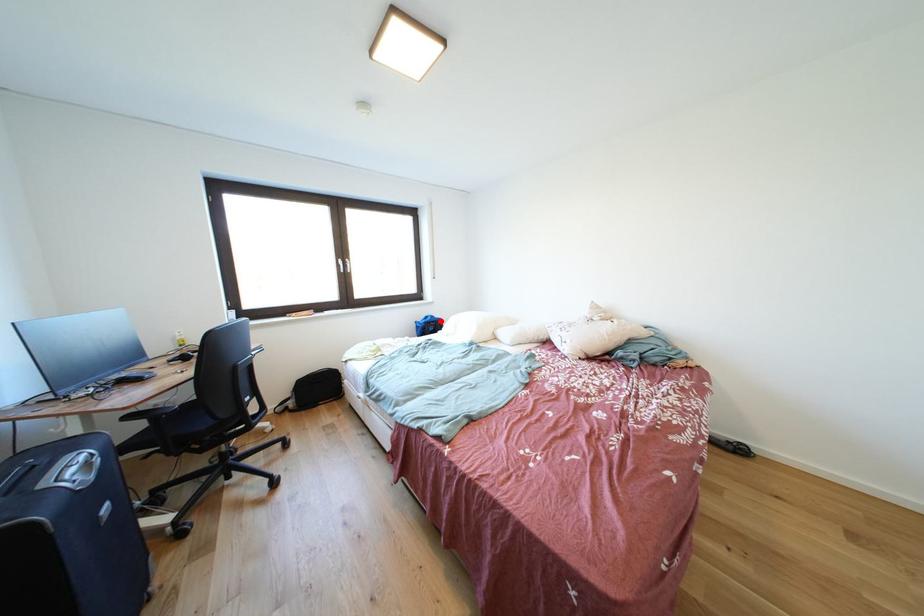
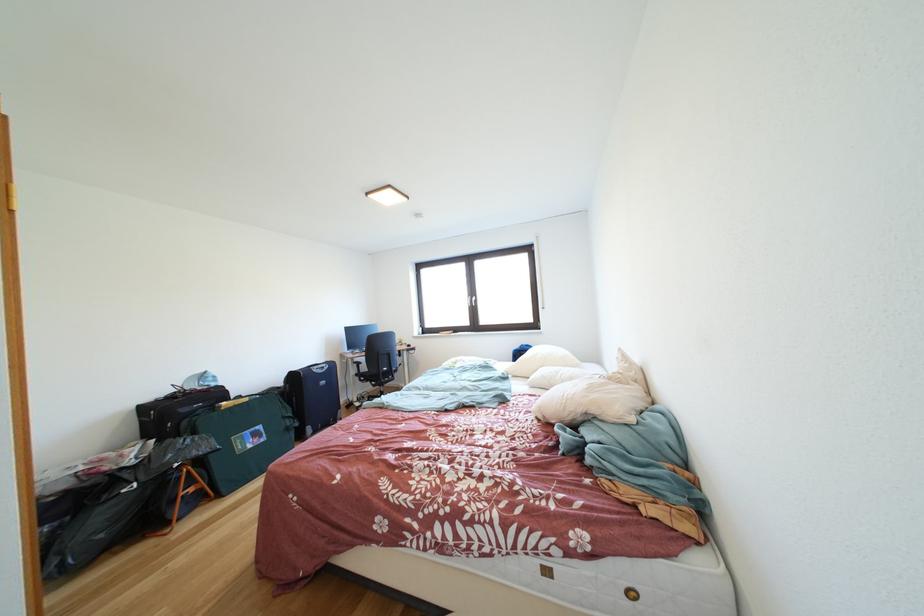
The point at the highlighted location is marked in the first image. Where is the corresponding point in the second image?

(535, 351)